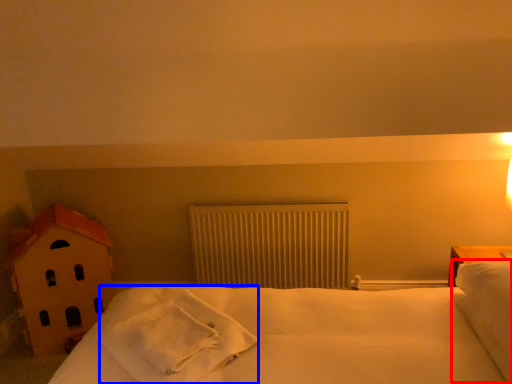
Question: Which point is further to the camera, pillow (highlighted by a red box) or material (highlighted by a blue box)?

Choices:
 (A) pillow
 (B) material

Answer: (B)